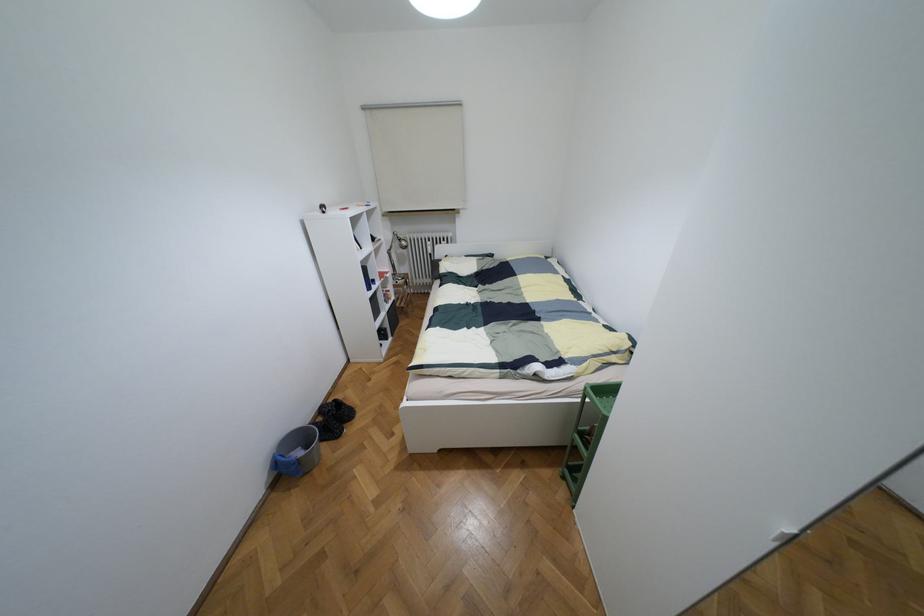
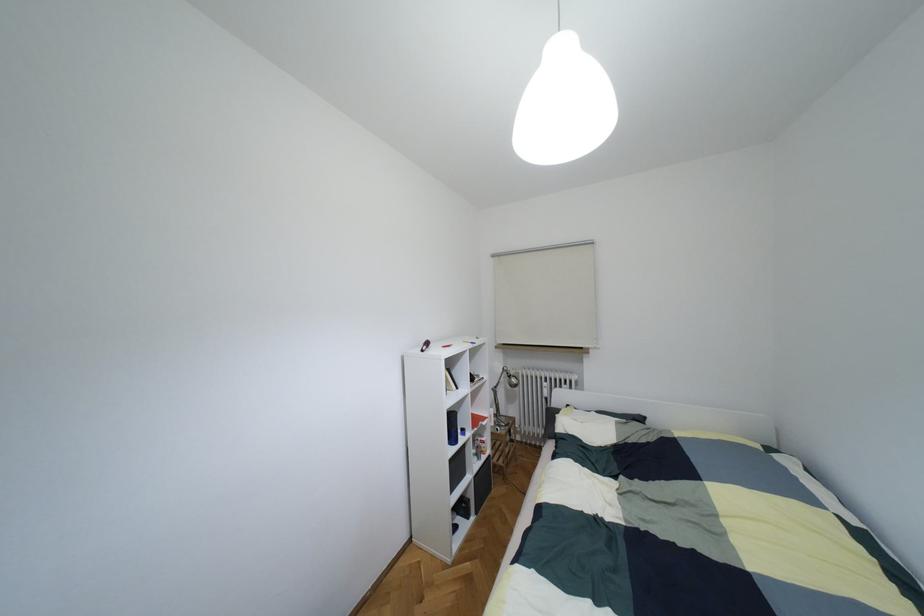
Find the pixel in the second image that matches pixel 382 333 in the first image.

(460, 508)